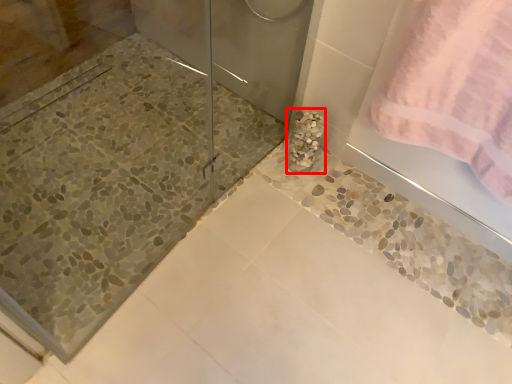
Question: From the image's perspective, what is the correct spatial positioning of marble (annotated by the red box) in reference to towel?

Choices:
 (A) above
 (B) below

Answer: (B)